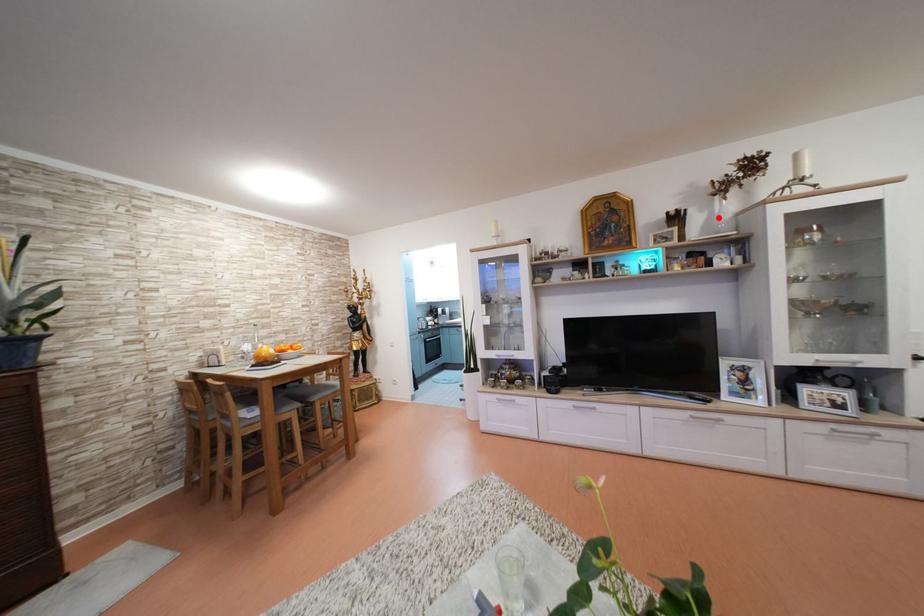
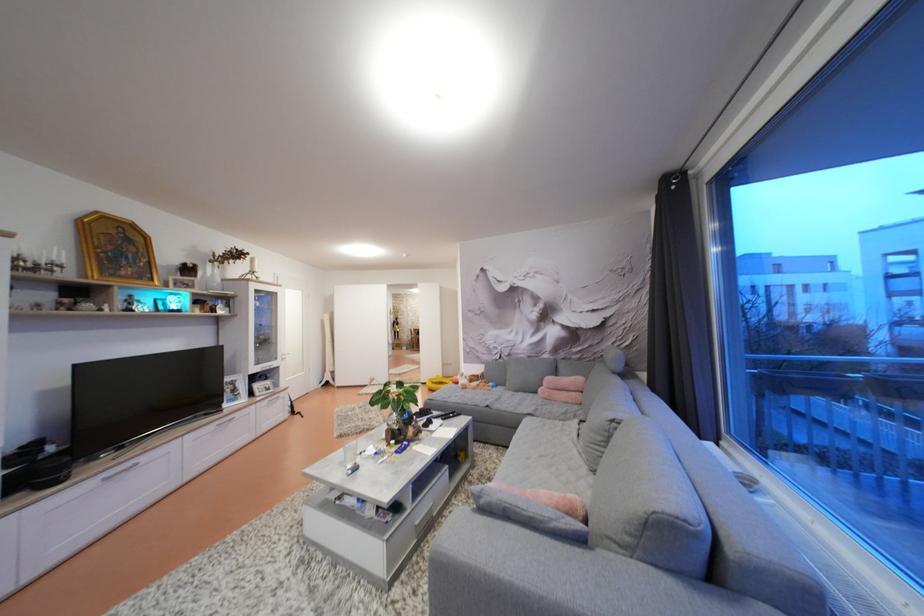
In the second image, find the point that corresponds to the highlighted location in the first image.

(213, 278)